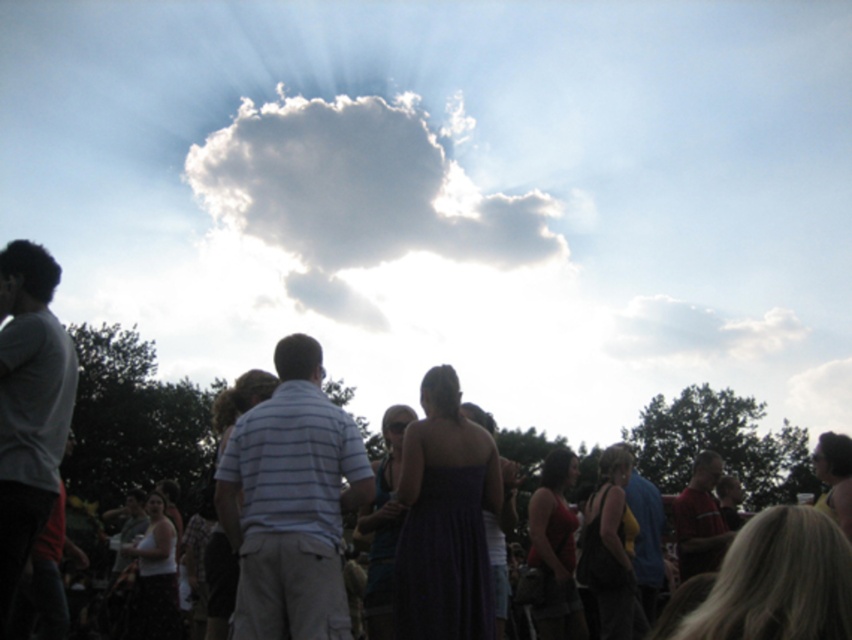
You are a photographer standing at the camera position. You want to take a photo of the white striped shirt at center. Is the subject within your camera range? The camera has a maximum focus range of 12 meters.

The white striped shirt at center is 12.18 meters away from camera, which exceeds the camera maximum focus range of 12 meters. Therefore, the subject is out of focus and cannot be captured clearly.